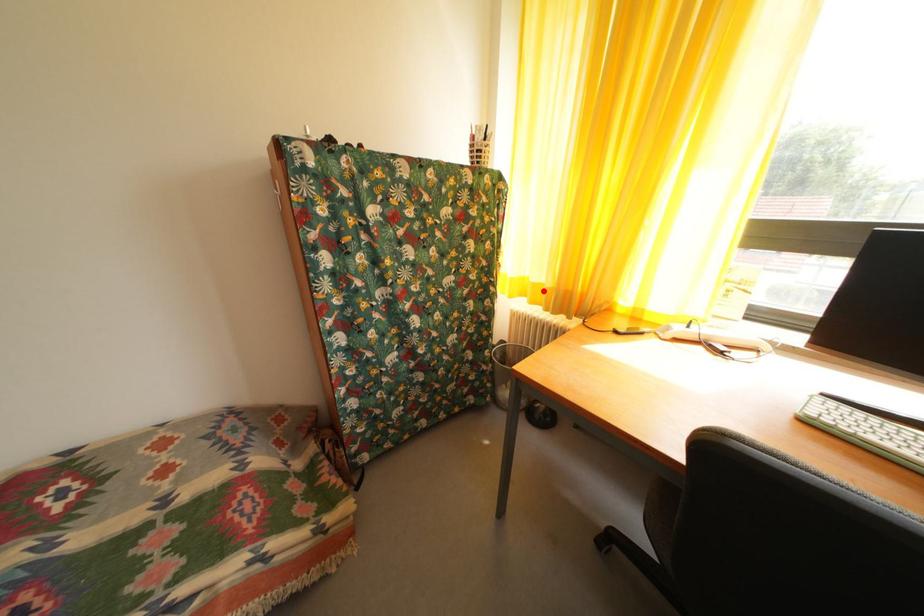
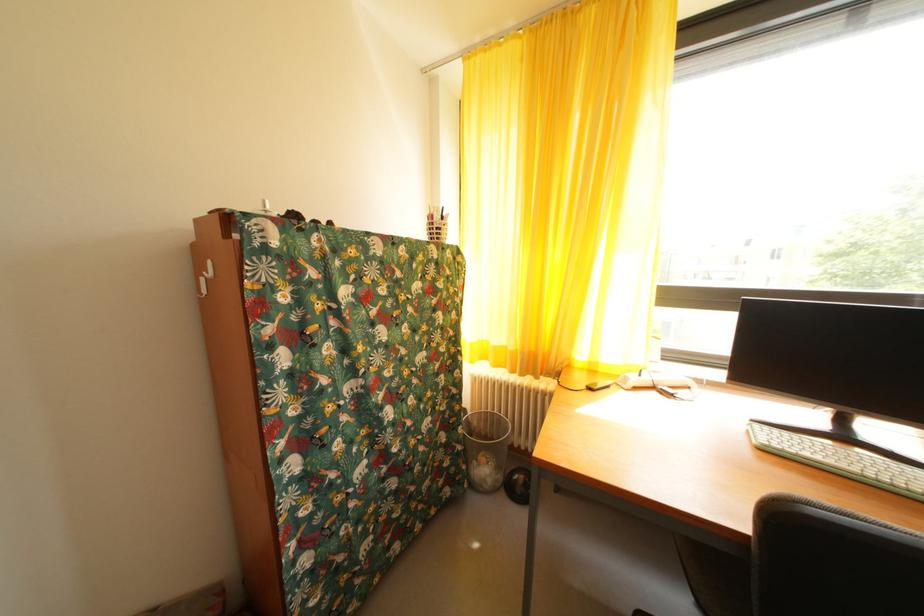
Question: I am providing you with two images of the same scene from different viewpoints. Image1 has a red point marked. In image2, the corresponding 3D location appears at what relative position? Reply with the corresponding letter.

Choices:
 (A) Closer
 (B) Farther

Answer: (B)